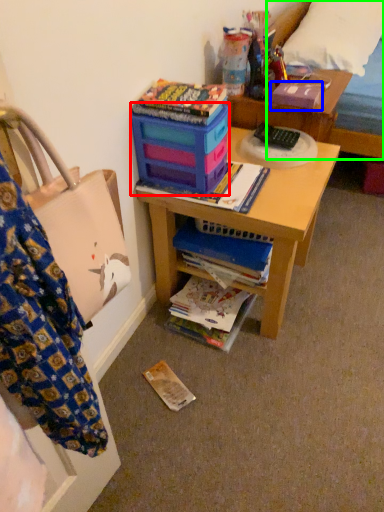
Question: Estimate the real-world distances between objects in this image. Which object is closer to box (highlighted by a red box), paperback book (highlighted by a blue box) or bed (highlighted by a green box)?

Choices:
 (A) paperback book
 (B) bed

Answer: (A)